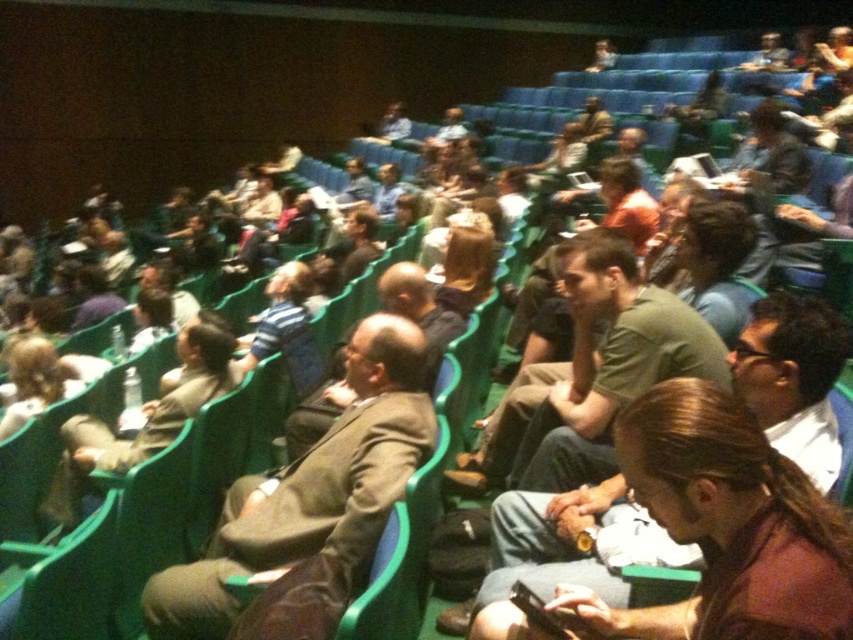
Question: Which point is closer to the camera?

Choices:
 (A) green matte shirt at center
 (B) brown leather jacket at center
 (C) green cotton shirt at center

Answer: (C)

Question: Is brown leather jacket at center to the right of green cotton shirt at center from the viewer's perspective?

Choices:
 (A) no
 (B) yes

Answer: (A)

Question: Observing the image, what is the correct spatial positioning of green cotton shirt at center in reference to green matte shirt at center?

Choices:
 (A) above
 (B) below

Answer: (B)

Question: Which point appears closest to the camera in this image?

Choices:
 (A) (252, 561)
 (B) (599, 579)
 (C) (579, 422)

Answer: (B)

Question: Estimate the real-world distances between objects in this image. Which object is closer to the green cotton shirt at center?

Choices:
 (A) brown leather jacket at center
 (B) green matte shirt at center

Answer: (B)

Question: From the image, what is the correct spatial relationship of green cotton shirt at center in relation to green matte shirt at center?

Choices:
 (A) above
 (B) below

Answer: (B)